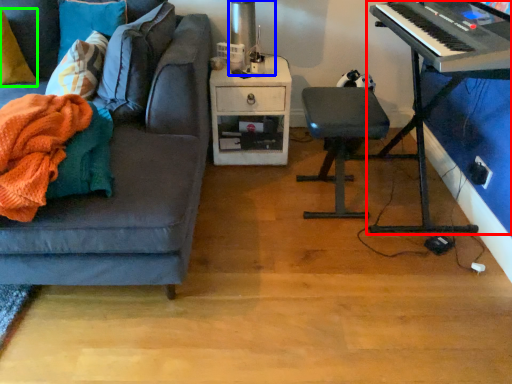
Question: Estimate the real-world distances between objects in this image. Which object is farther from piano (highlighted by a red box), table lamp (highlighted by a blue box) or pillow (highlighted by a green box)?

Choices:
 (A) table lamp
 (B) pillow

Answer: (B)